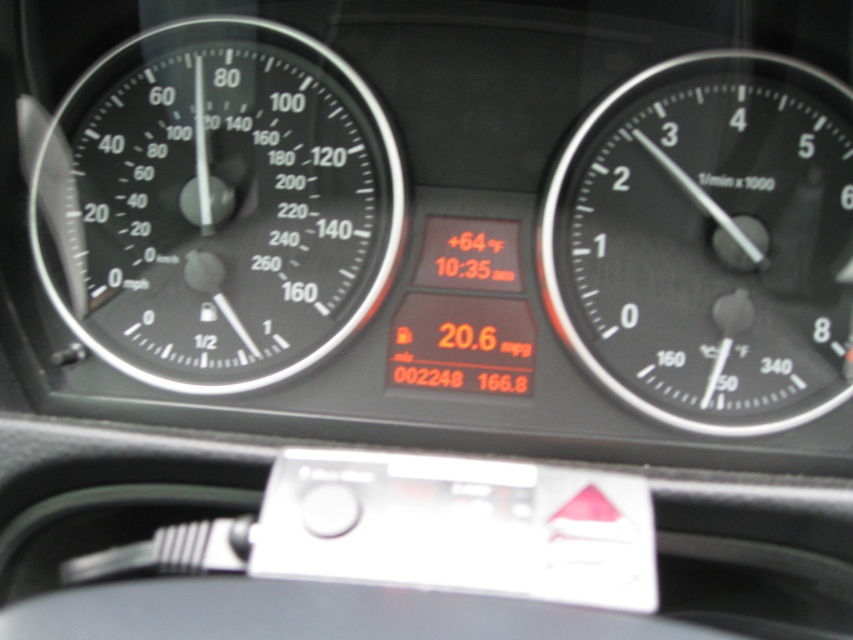
Is black glass speedometer at left thinner than black matte tachometer at right?

Incorrect, black glass speedometer at left's width is not less than black matte tachometer at right's.

Which of these two, black glass speedometer at left or black matte tachometer at right, stands shorter?

black matte tachometer at right

Is point (125, 145) farther from camera compared to point (654, 400)?

Yes, point (125, 145) is behind point (654, 400).

Locate an element on the screen. black glass speedometer at left is located at coordinates (218, 204).